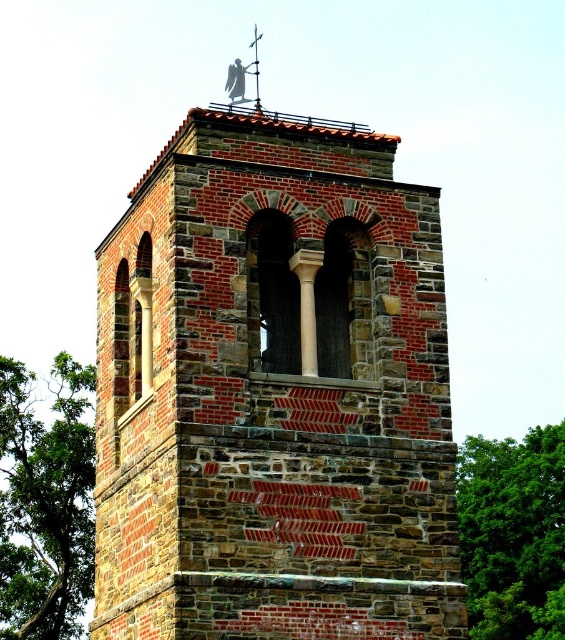
You are standing in front of the historic stone tower. You notice two green leafy trees in the scene. Which tree is closer to you, the green leafy tree at lower left or the green leafy tree at right?

The green leafy tree at lower left is closer to you because the green leafy tree at right is behind it.

You are standing in a park and see the brick tower at center and the green leafy tree at right. Which object is closer to you?

The brick tower at center is closer to you because it is in front of the green leafy tree at right.

You are standing in front of the brick tower at center and want to take a photo of the green leafy tree at lower left. Which direction should you turn to face the tree?

The brick tower at center is to the right of the green leafy tree at lower left, so you should turn to your left to face the tree.